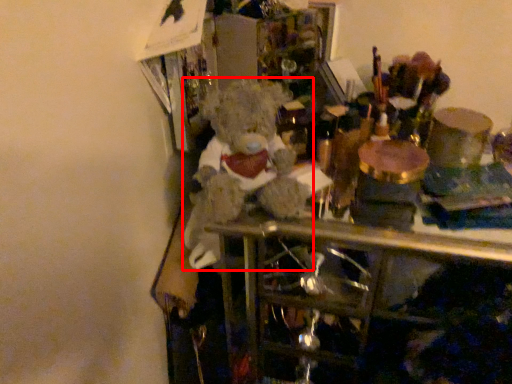
Question: Observing the image, what is the correct spatial positioning of teddy bear (annotated by the red box) in reference to wine bottle?

Choices:
 (A) left
 (B) right

Answer: (A)